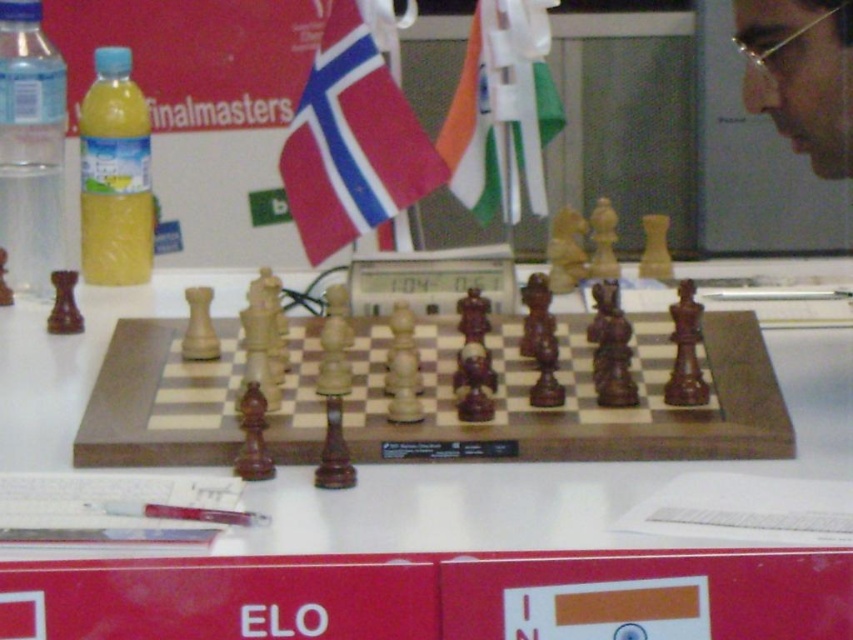
You are a photographer setting up for a chess tournament photo. You need to position your camera so that both the red fabric flag at center and the yellow translucent bottle at left are in frame. According to the scene description, which object should be placed closer to the left side of the camera frame?

The yellow translucent bottle at left should be placed closer to the left side of the camera frame because the red fabric flag at center is to the right of it.

You are a photographer setting up for a chess tournament photo shoot. You need to ensure that the red fabric flag at center and the clear plastic bottle at left are visible in the frame. Given their heights, which object will you position closer to the camera to ensure both are fully visible?

The red fabric flag at center is shorter than the clear plastic bottle at left. To ensure both are fully visible, position the shorter red fabric flag at center closer to the camera so that its height remains in frame while accommodating the taller clear plastic bottle at left in the background.

You are a photographer at a chess tournament. You need to capture a photo of the red fabric flag at center and the yellow translucent bottle at left. Which object should you zoom in on to ensure both are clearly visible in the frame?

The red fabric flag at center is bigger than the yellow translucent bottle at left, so you should zoom in on the smaller yellow translucent bottle at left to ensure both are clearly visible in the frame.